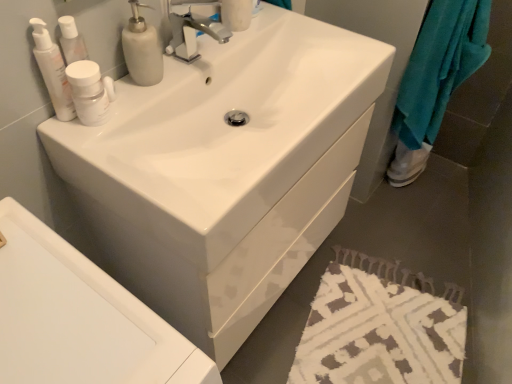
Question: Can you confirm if white matte soap dispenser at upper left is positioned to the right of white glossy sink at center?

Choices:
 (A) yes
 (B) no

Answer: (B)

Question: Can you confirm if white matte soap dispenser at upper left is wider than white glossy sink at center?

Choices:
 (A) yes
 (B) no

Answer: (B)

Question: Considering the relative sizes of white matte soap dispenser at upper left and white glossy sink at center in the image provided, is white matte soap dispenser at upper left shorter than white glossy sink at center?

Choices:
 (A) yes
 (B) no

Answer: (B)

Question: Is white matte soap dispenser at upper left positioned behind white glossy sink at center?

Choices:
 (A) yes
 (B) no

Answer: (A)

Question: From the image's perspective, is white matte soap dispenser at upper left over white glossy sink at center?

Choices:
 (A) yes
 (B) no

Answer: (A)

Question: Is white matte soap dispenser at upper left positioned in front of white glossy sink at center?

Choices:
 (A) yes
 (B) no

Answer: (B)

Question: Is white glossy sink at center far away from white glossy bottle at upper left, the second mouthwash viewed from the right?

Choices:
 (A) yes
 (B) no

Answer: (B)

Question: Can you confirm if white glossy sink at center is thinner than white glossy bottle at upper left, the second mouthwash viewed from the right?

Choices:
 (A) yes
 (B) no

Answer: (B)

Question: Considering the relative sizes of white glossy sink at center and white glossy bottle at upper left, which is the first mouthwash from left to right, in the image provided, is white glossy sink at center shorter than white glossy bottle at upper left, which is the first mouthwash from left to right,?

Choices:
 (A) no
 (B) yes

Answer: (B)

Question: Is white glossy bottle at upper left, the second mouthwash viewed from the right, at the back of white glossy sink at center?

Choices:
 (A) yes
 (B) no

Answer: (B)

Question: Is white glossy sink at center touching white glossy bottle at upper left, the second mouthwash viewed from the right?

Choices:
 (A) yes
 (B) no

Answer: (B)

Question: Is white glossy sink at center completely or partially outside of white glossy bottle at upper left, which is the first mouthwash from left to right?

Choices:
 (A) yes
 (B) no

Answer: (A)

Question: Considering the relative sizes of white textured bath mat at lower right and white matte bottle at upper left, which is the 2th mouthwash from left to right, in the image provided, is white textured bath mat at lower right bigger than white matte bottle at upper left, which is the 2th mouthwash from left to right,?

Choices:
 (A) yes
 (B) no

Answer: (A)